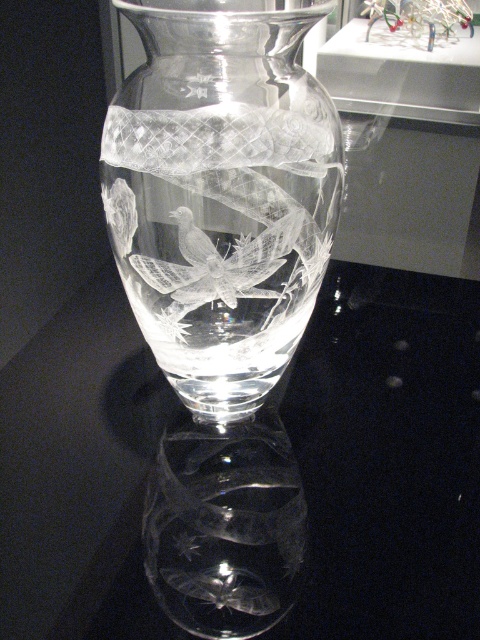
Question: From the image, what is the correct spatial relationship of transparent glass vase at center in relation to clear crystal vase at center?

Choices:
 (A) above
 (B) below

Answer: (B)

Question: Does transparent glass vase at center have a larger size compared to clear crystal vase at center?

Choices:
 (A) no
 (B) yes

Answer: (B)

Question: Among these objects, which one is nearest to the camera?

Choices:
 (A) clear crystal vase at center
 (B) transparent glass vase at center

Answer: (A)

Question: Does transparent glass vase at center appear under clear crystal vase at center?

Choices:
 (A) yes
 (B) no

Answer: (A)

Question: Which point is closer to the camera?

Choices:
 (A) (369, 342)
 (B) (180, 312)

Answer: (B)